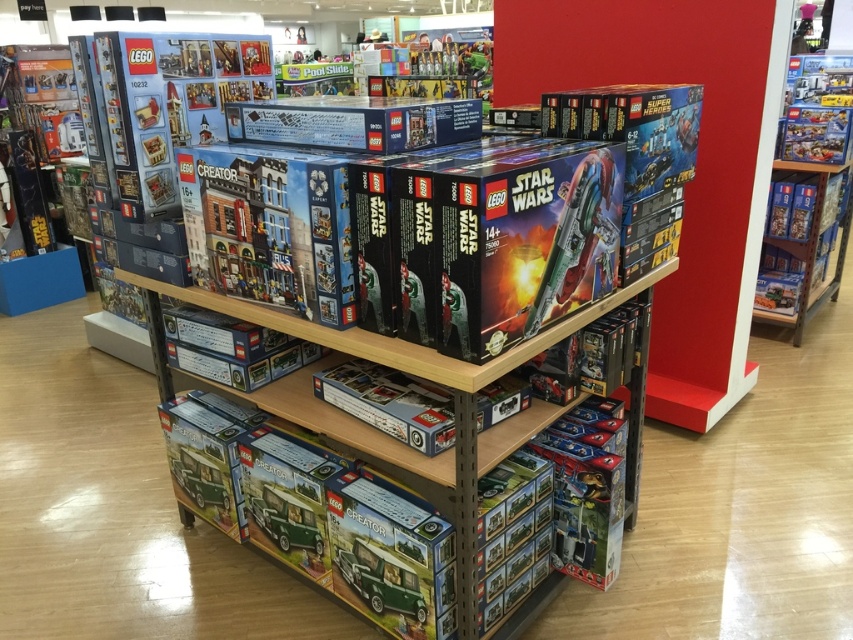
You are a store employee who needs to place a new LEGO set that is 24 inches wide. You have space between the matte blue building at center and the glossy plastic spaceship at center. Can the new set fit in that space?

The space between the matte blue building at center and the glossy plastic spaceship at center is 25.46 inches. Since the new set is 24 inches wide, it can fit in the available space.

You are a customer in the LEGO store looking at the display. You notice the matte blue building at center and the green matte van at lower center. Which object is taller?

The matte blue building at center is taller than the green matte van at lower center.

You are a customer looking at the LEGO display. You see a glossy plastic spaceship at center and a green matte van at lower center. Which object is positioned closer to your viewpoint?

The glossy plastic spaceship at center is closer to the viewer than the green matte van at lower center.